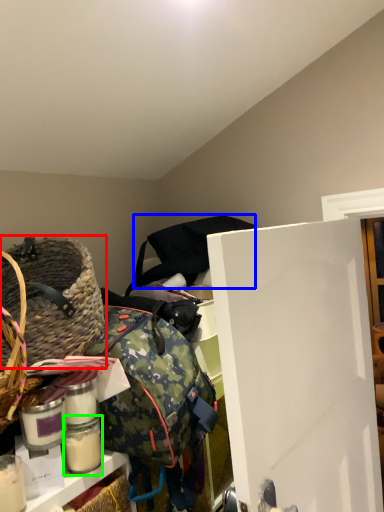
Question: Which is farther away from picnic basket (highlighted by a red box)? bag (highlighted by a blue box) or glass jar (highlighted by a green box)?

Choices:
 (A) bag
 (B) glass jar

Answer: (A)